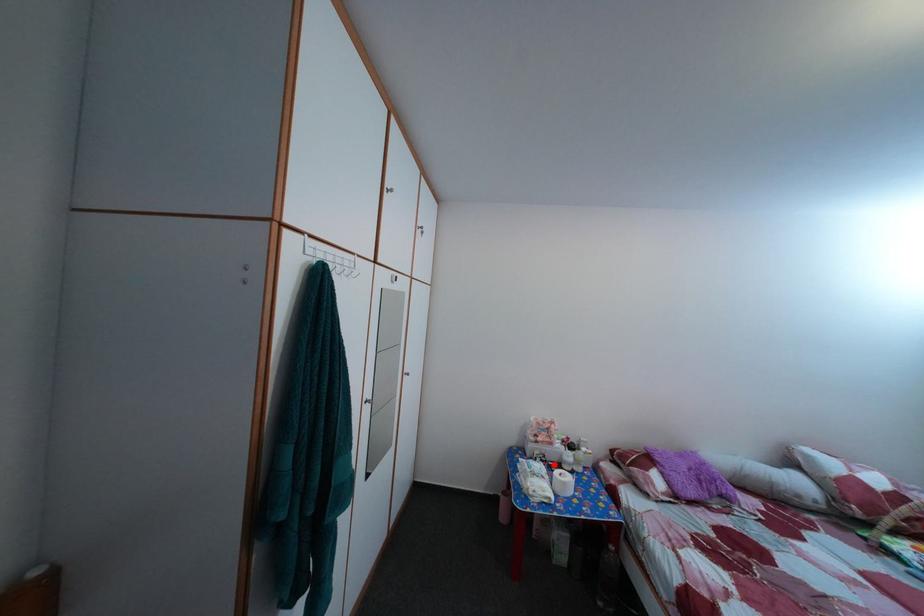
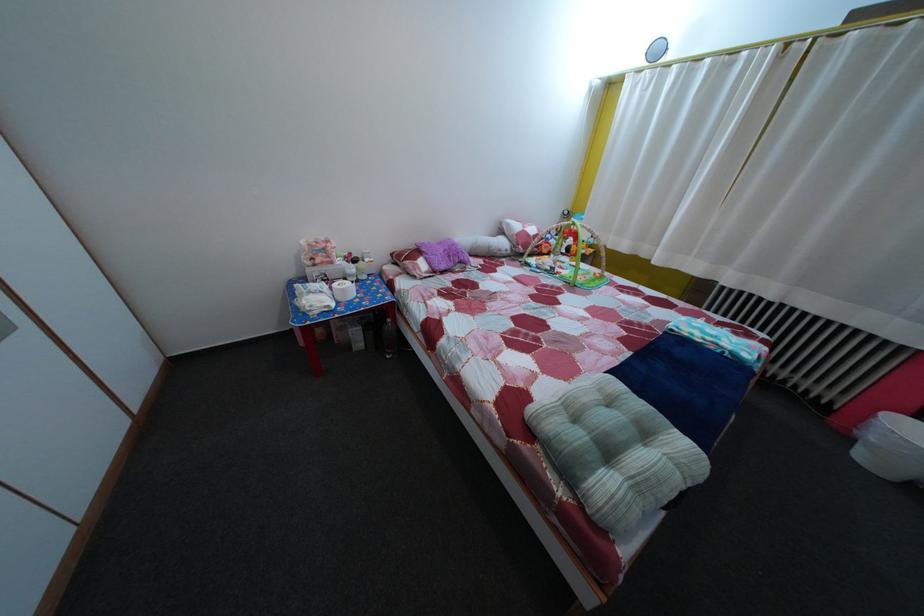
Question: I am providing you with two images of the same scene from different viewpoints. In image1, a red point is highlighted. Considering the same 3D point in image2, which of the following is correct?

Choices:
 (A) It is closer
 (B) It is farther

Answer: (A)